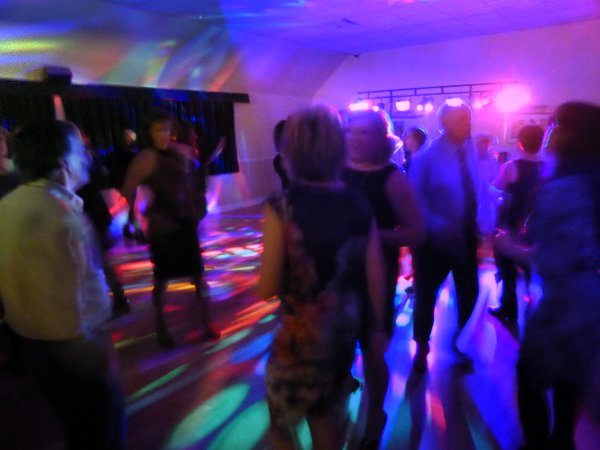
Identify the location of lights. This screenshot has height=450, width=600. point(515,94), point(403,105), point(424,104), point(453,98), point(480,107), point(360,103).